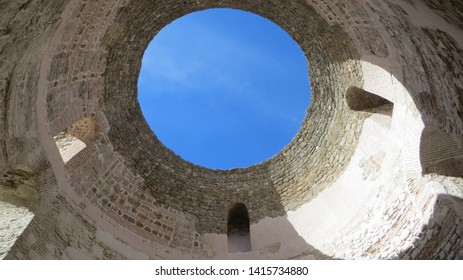
Locate an element on the screen. This screenshot has height=280, width=463. archway is located at coordinates (418, 135), (35, 168).